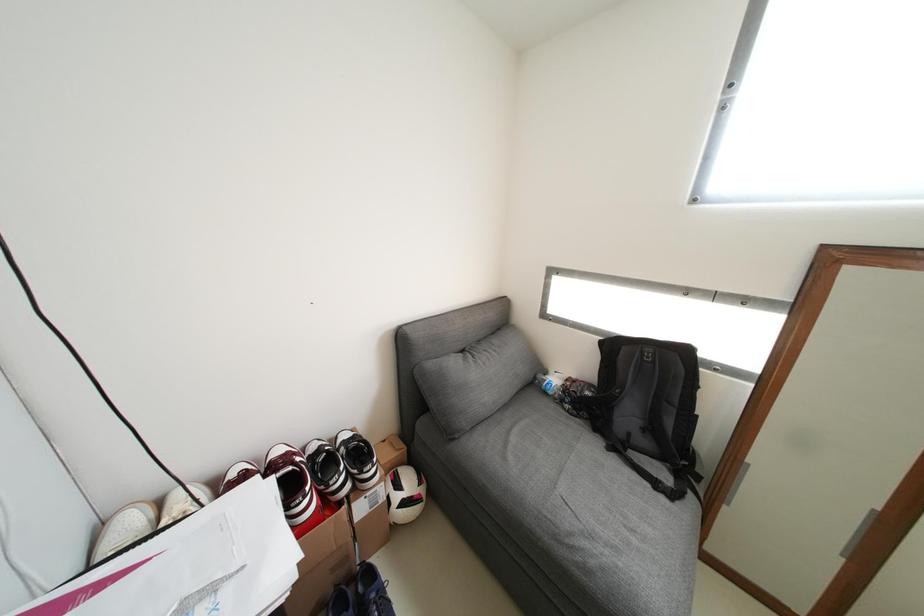
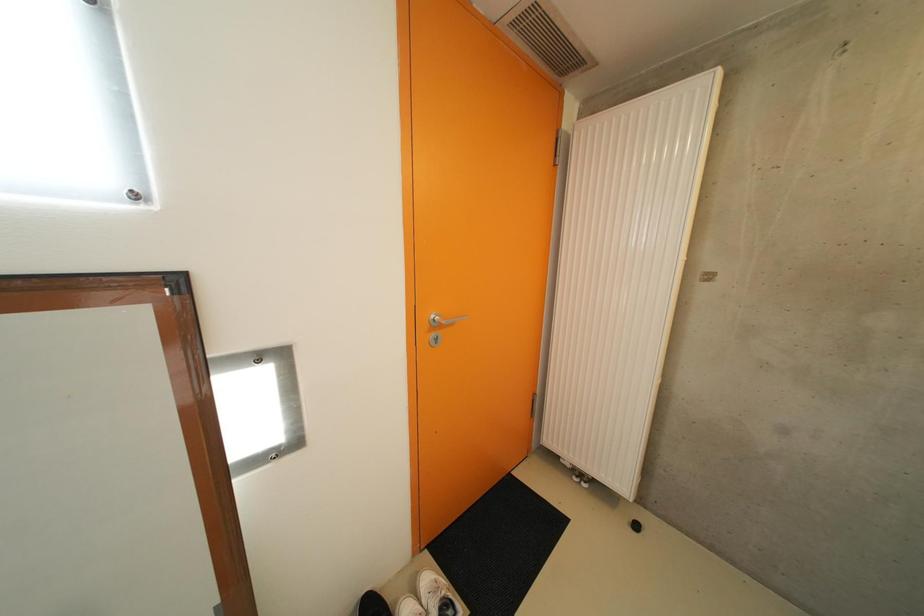
Question: The camera is either moving clockwise (left) or counter-clockwise (right) around the object. The first image is from the beginning of the video and the second image is from the end. Is the camera moving left or right when shooting the video?

Choices:
 (A) Left
 (B) Right

Answer: (A)